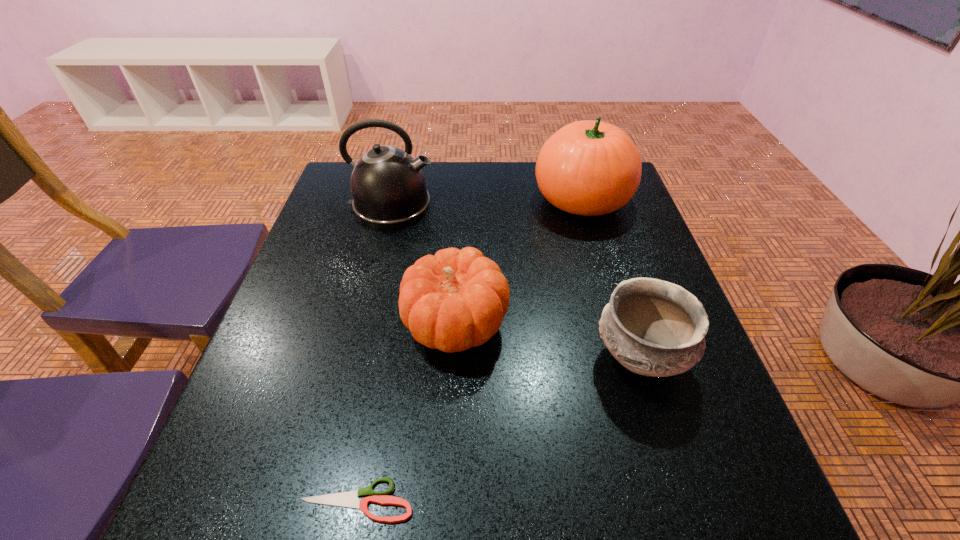
At what (x,y) coordinates should I click in order to perform the action: click on kettle. Please return your answer as a coordinate pair (x, y). The height and width of the screenshot is (540, 960). Looking at the image, I should click on tap(388, 187).

Locate an element on the screen. The image size is (960, 540). the farther pumpkin is located at coordinates (590, 168).

Where is `the right pumpkin`? This screenshot has height=540, width=960. the right pumpkin is located at coordinates (590, 168).

Find the location of a particular element. The width and height of the screenshot is (960, 540). the nearer pumpkin is located at coordinates (455, 300).

In order to click on the left pumpkin in this screenshot , I will do `click(455, 300)`.

You are a GUI agent. You are given a task and a screenshot of the screen. Output one action in this format:
    pyautogui.click(x=<x>, y=<y>)
    Task: Click on the pottery
    This screenshot has width=960, height=540.
    Given the screenshot: What is the action you would take?
    pyautogui.click(x=652, y=327)

In order to click on the shortest object in this screenshot , I will do `click(350, 499)`.

Identify the location of scissors. This screenshot has width=960, height=540. (350, 499).

Where is `free space located 0.100m on the spout of the kettle`? Image resolution: width=960 pixels, height=540 pixels. free space located 0.100m on the spout of the kettle is located at coordinates (471, 207).

Find the location of `vacant space located 0.390m on the left of the taller pumpkin`. vacant space located 0.390m on the left of the taller pumpkin is located at coordinates (396, 199).